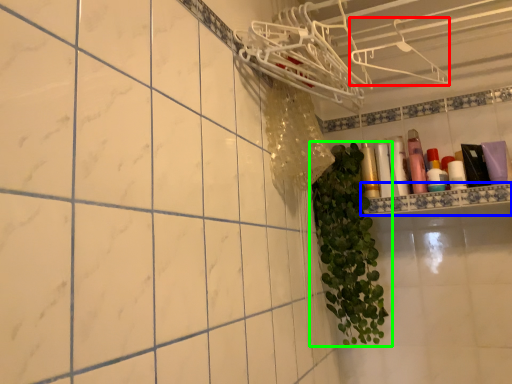
Question: Considering the real-world distances, which object is closest to hanger (highlighted by a red box)? ledge (highlighted by a blue box) or houseplant (highlighted by a green box).

Choices:
 (A) ledge
 (B) houseplant

Answer: (A)